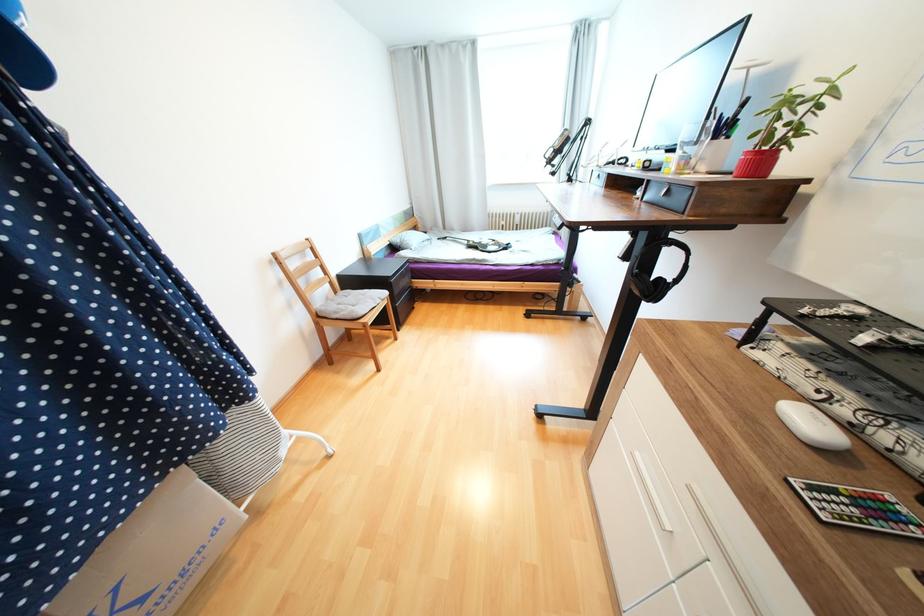
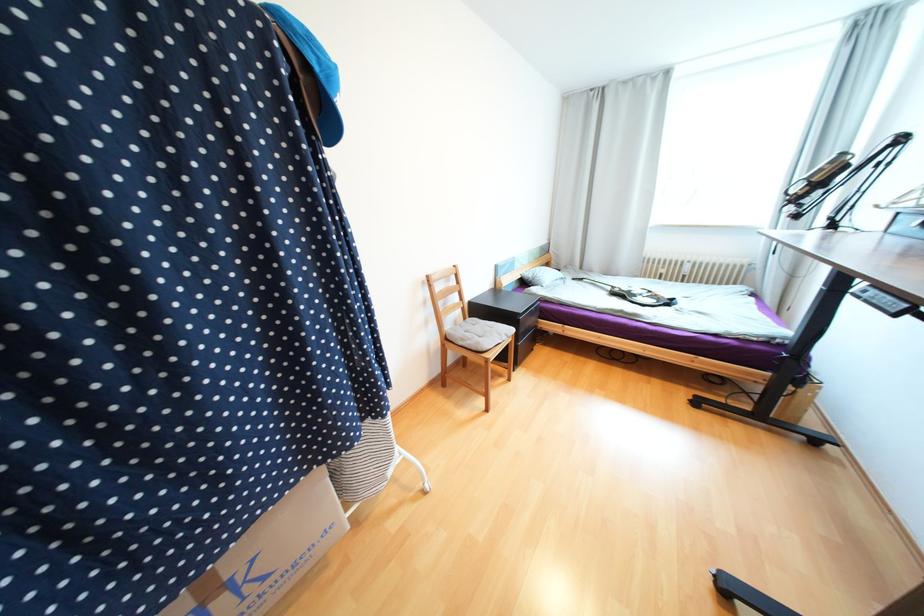
Question: The camera is either moving clockwise (left) or counter-clockwise (right) around the object. The first image is from the beginning of the video and the second image is from the end. Is the camera moving left or right when shooting the video?

Choices:
 (A) Left
 (B) Right

Answer: (B)